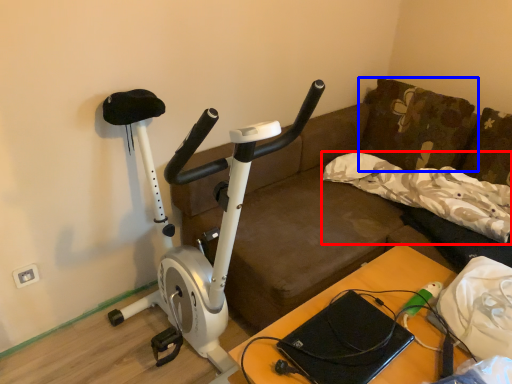
Question: Which point is closer to the camera, pillow (highlighted by a red box) or pillow (highlighted by a blue box)?

Choices:
 (A) pillow
 (B) pillow

Answer: (A)